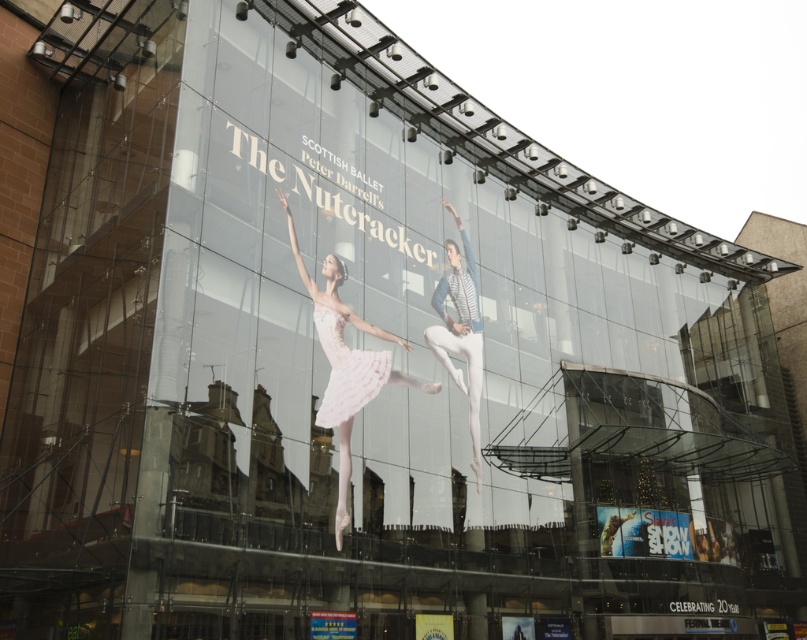
Question: Among these points, which one is farthest from the camera?

Choices:
 (A) (429, 330)
 (B) (341, 321)

Answer: (A)

Question: Which is farther from the light pink satin tutu at center?

Choices:
 (A) white matte ballet dancer at center
 (B) white tulle skirt at center

Answer: (A)

Question: Where is light pink satin tutu at center located in relation to white tulle skirt at center in the image?

Choices:
 (A) below
 (B) above

Answer: (A)

Question: Can you confirm if light pink satin tutu at center is bigger than white tulle skirt at center?

Choices:
 (A) no
 (B) yes

Answer: (B)

Question: Is light pink satin tutu at center thinner than white tulle skirt at center?

Choices:
 (A) yes
 (B) no

Answer: (B)

Question: Among these points, which one is nearest to the camera?

Choices:
 (A) (312, 282)
 (B) (454, 216)

Answer: (A)